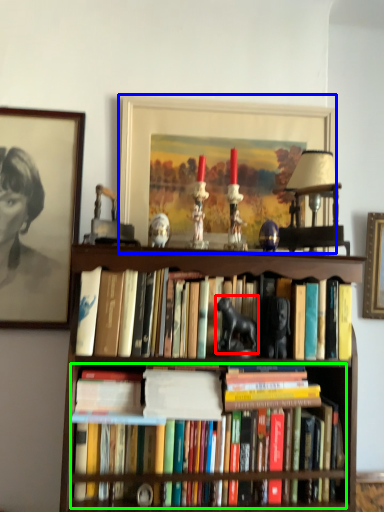
Question: Considering the real-world distances, which object is farthest from animal (highlighted by a red box)? picture frame (highlighted by a blue box) or book (highlighted by a green box)?

Choices:
 (A) picture frame
 (B) book

Answer: (A)